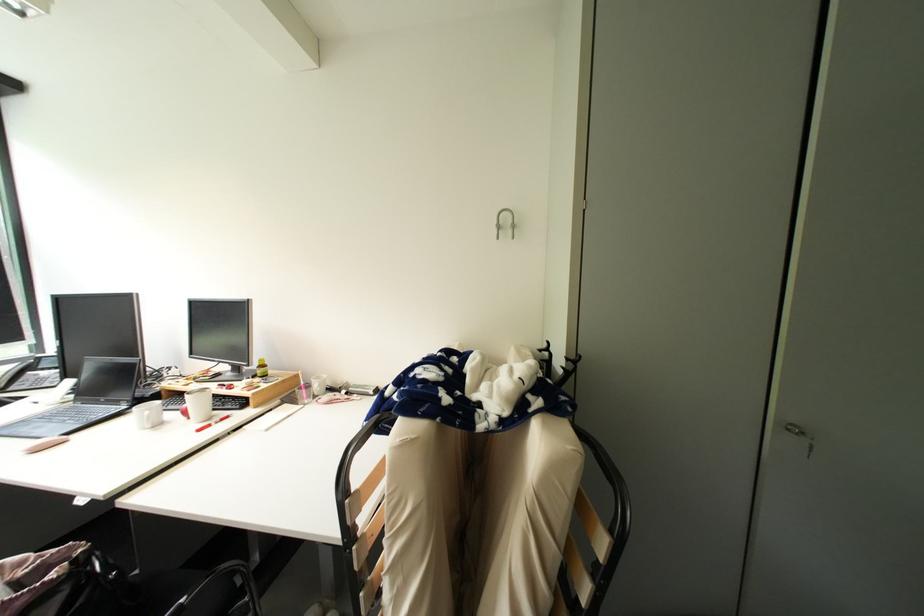
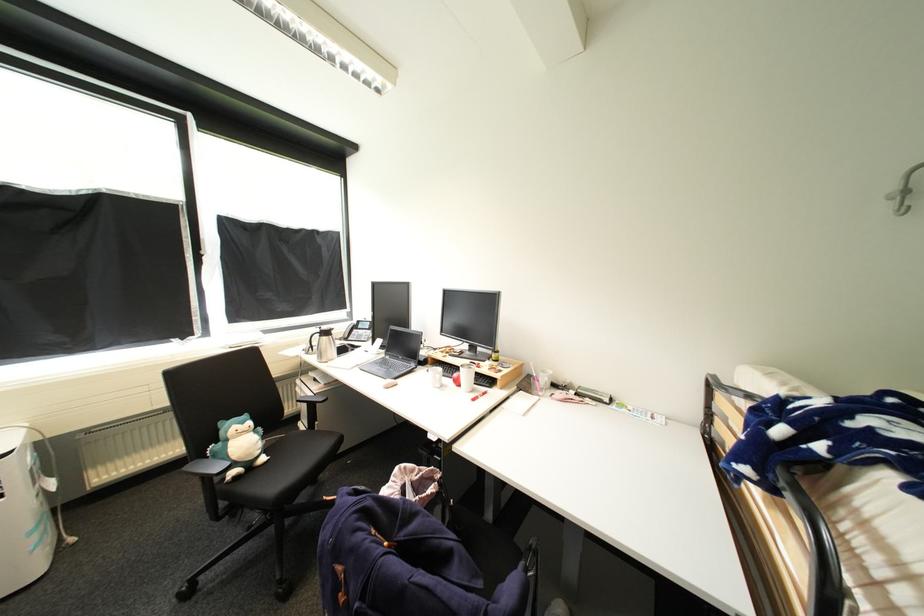
Where in the second image is the point corresponding to (50,370) from the first image?

(367, 330)